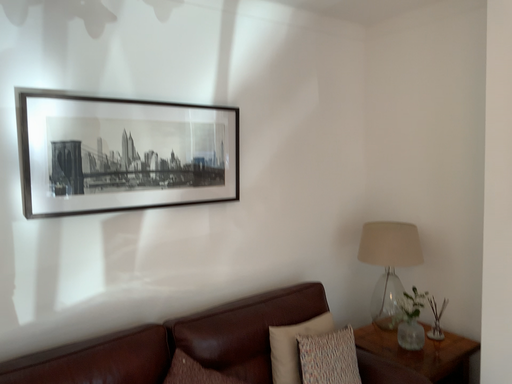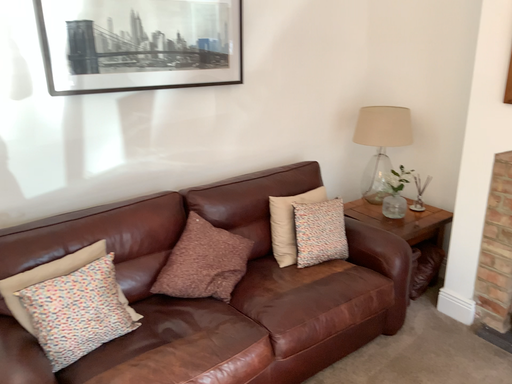
Question: How did the camera likely rotate when shooting the video?

Choices:
 (A) rotated downward
 (B) rotated upward

Answer: (A)